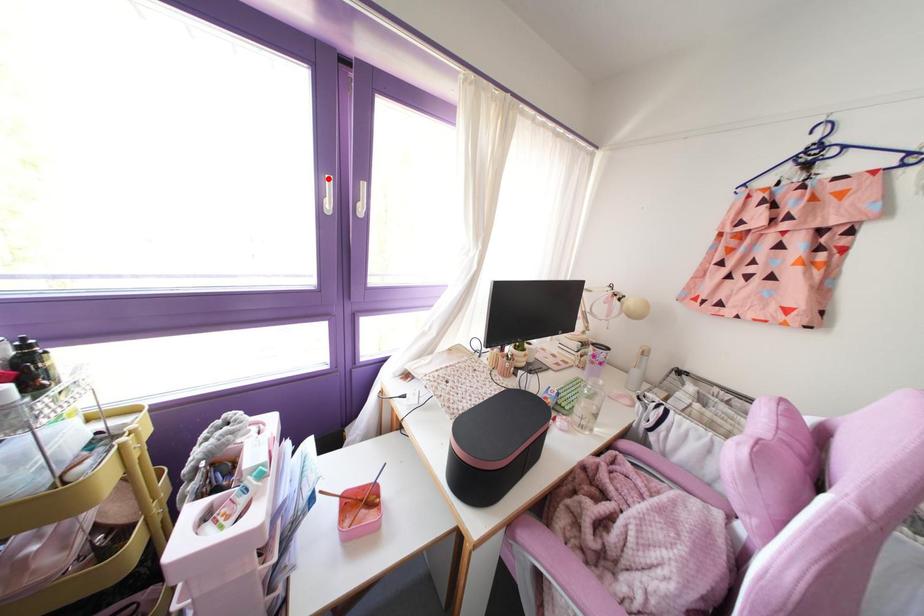
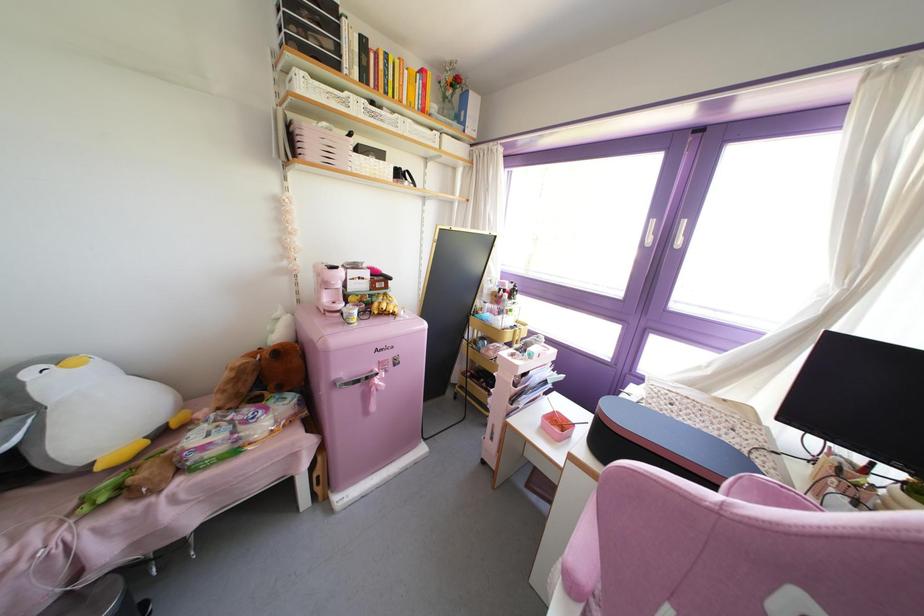
Find the pixel in the second image that matches the highlighted location in the first image.

(652, 222)